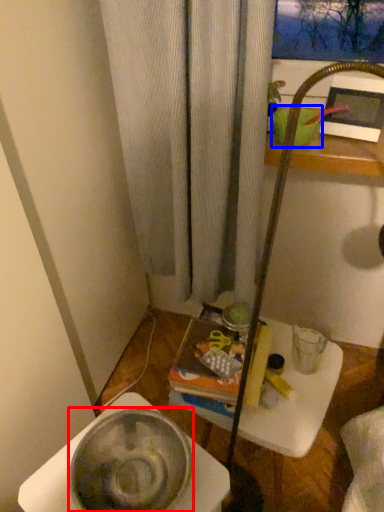
Question: Which of the following is the closest to the observer, basin (highlighted by a red box) or basin (highlighted by a blue box)?

Choices:
 (A) basin
 (B) basin

Answer: (A)